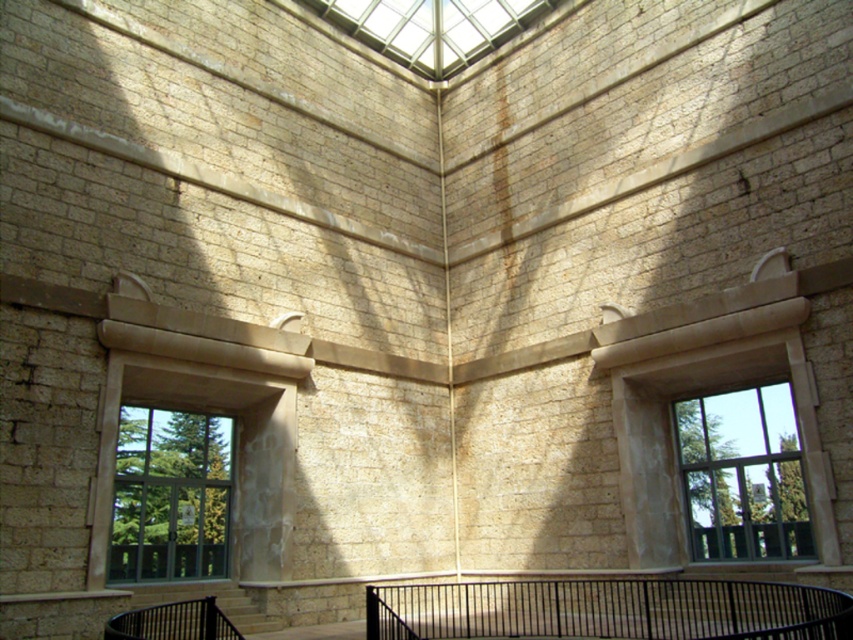
You are an architect designing a new building and want to ensure that the clear glass window at left and the transparent glass skylight at upper center are positioned such that they are at least 25 meters apart. Based on the image provided, does the current placement meet your requirement?

The distance between the clear glass window at left and the transparent glass skylight at upper center is 26.12 meters, which exceeds the required 25 meters. Therefore, the current placement meets the requirement.

You are standing inside the circular room and want to look outside through the clear glass window at left and the transparent glass skylight at upper center. Which one allows you to see the outside environment more clearly?

Both the clear glass window at left and the transparent glass skylight at upper center are made of glass, but the clear glass window at left is closer to the viewer, so it might provide a clearer view due to its proximity.